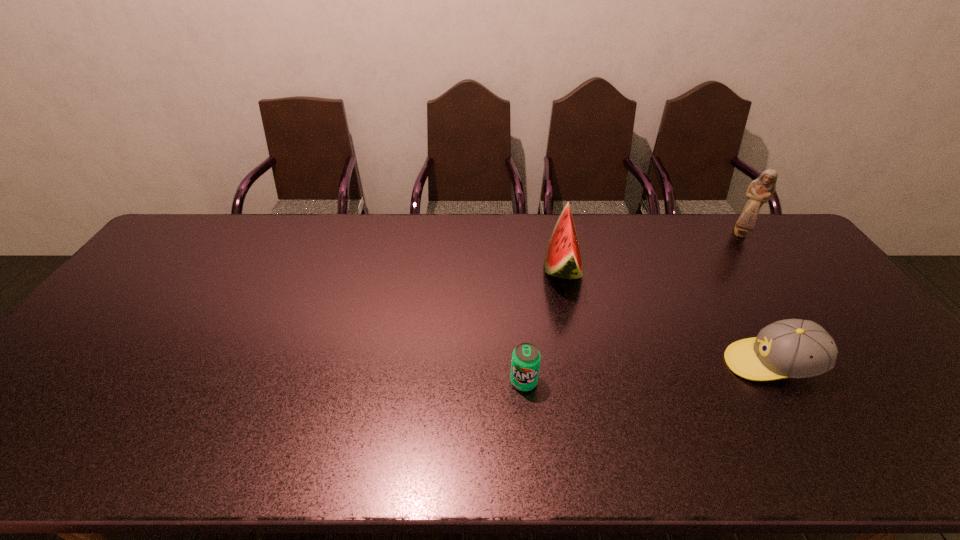
Find the location of a particular element. The height and width of the screenshot is (540, 960). the rightmost object is located at coordinates (760, 191).

This screenshot has width=960, height=540. I want to click on figurine, so click(760, 191).

Locate an element on the screen. This screenshot has height=540, width=960. watermelon is located at coordinates (563, 259).

The height and width of the screenshot is (540, 960). What are the coordinates of `the third object from right to left` in the screenshot? It's located at (563, 259).

Locate an element on the screen. baseball cap is located at coordinates (792, 348).

Identify the location of pop soda. (525, 364).

At what (x,y) coordinates should I click in order to perform the action: click on vacant space positioned 0.080m on the front-facing side of the rightmost object. Please return your answer as a coordinate pair (x, y). The image size is (960, 540). Looking at the image, I should click on (756, 256).

Find the location of a particular element. vacant space situated 0.140m on the outer rind of the second tallest object is located at coordinates (499, 266).

The image size is (960, 540). Identify the location of vacant area located 0.380m on the outer rind of the second tallest object. (424, 266).

Locate an element on the screen. vacant space located on the outer rind of the second tallest object is located at coordinates (445, 266).